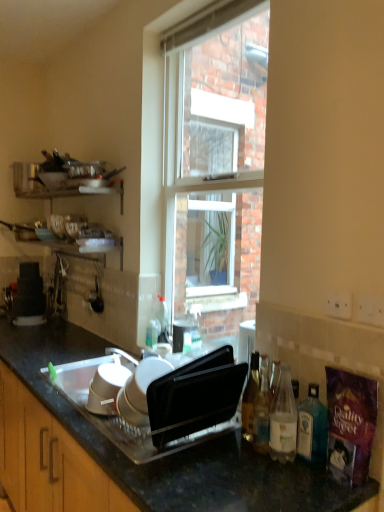
Question: Does point (289, 397) appear closer or farther from the camera than point (248, 388)?

Choices:
 (A) farther
 (B) closer

Answer: (B)

Question: Looking at the image, does translucent glass bottle at lower right, positioned as the 2th bottle in right-to-left order, seem bigger or smaller compared to translucent glass bottle at right, positioned as the fourth bottle in right-to-left order?

Choices:
 (A) big
 (B) small

Answer: (A)

Question: Which of these objects is positioned farthest from the clear glass window at center?

Choices:
 (A) translucent glass bottle at right, which ranks as the 1th bottle in right-to-left order
 (B) translucent glass bottle at lower right, positioned as the 2th bottle in right-to-left order
 (C) translucent glass bottle at right, positioned as the fourth bottle in right-to-left order
 (D) white plastic cups at lower left, the 1th appliance in the bottom-to-top sequence
 (E) black granite countertop at center

Answer: (A)

Question: Considering the real-world distances, which object is closest to the clear glass window at center?

Choices:
 (A) matte black toaster at left, which is the 2th appliance in bottom-to-top order
 (B) translucent glass bottle at right, positioned as the fourth bottle in right-to-left order
 (C) translucent glass bottle at lower right, acting as the second bottle starting from the left
 (D) black granite countertop at center
 (E) translucent glass bottle at right, the 4th bottle positioned from the left

Answer: (A)